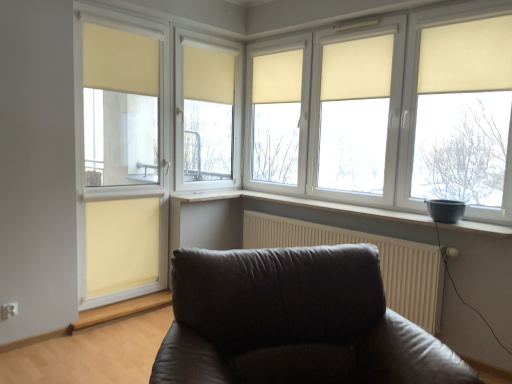
Find the location of a particular element. The image size is (512, 384). beige fabric curtain at center, acting as the 4th curtain starting from the right is located at coordinates pyautogui.click(x=208, y=74).

What do you see at coordinates (120, 60) in the screenshot?
I see `beige fabric curtain at upper left, arranged as the 5th curtain when viewed from the right` at bounding box center [120, 60].

Where is `translucent beige glass door at left`? This screenshot has height=384, width=512. translucent beige glass door at left is located at coordinates (121, 155).

The width and height of the screenshot is (512, 384). What do you see at coordinates (342, 208) in the screenshot?
I see `white matte window sill at center` at bounding box center [342, 208].

Consider the image. What is the approximate width of white matte window sill at center?

It is 27.93 centimeters.

This screenshot has width=512, height=384. Find the location of `beige fabric curtain at center, acting as the 4th curtain starting from the left`. beige fabric curtain at center, acting as the 4th curtain starting from the left is located at coordinates (277, 77).

At what (x,y) coordinates should I click in order to perform the action: click on beige fabric curtain at center, acting as the 4th curtain starting from the right. Please return your answer as a coordinate pair (x, y). Looking at the image, I should click on (208, 74).

Which object is thinner, beige fabric curtain at lower left, the 6th curtain when ordered from right to left, or translucent beige glass door at left?

beige fabric curtain at lower left, the 6th curtain when ordered from right to left, is thinner.

Does point (157, 237) appear closer or farther from the camera than point (112, 116)?

Clearly, point (157, 237) is more distant from the camera than point (112, 116).

Which of these two, beige fabric curtain at lower left, the 6th curtain when ordered from right to left, or translucent beige glass door at left, is bigger?

Bigger between the two is translucent beige glass door at left.

Is beige fabric curtain at lower left, arranged as the 1th curtain when viewed from the left, to the left or to the right of translucent beige glass door at left in the image?

From the image, it's evident that beige fabric curtain at lower left, arranged as the 1th curtain when viewed from the left, is to the left of translucent beige glass door at left.

Does beige fabric curtain at upper right, which is the sixth curtain from left to right, have a greater height compared to beige fabric curtain at center, acting as the third curtain starting from the right?

No, beige fabric curtain at upper right, which is the sixth curtain from left to right, is not taller than beige fabric curtain at center, acting as the third curtain starting from the right.

Image resolution: width=512 pixels, height=384 pixels. I want to click on curtain that is the 3rd one when counting downward from the beige fabric curtain at center, acting as the 4th curtain starting from the left (from the image's perspective), so click(x=466, y=56).

Is beige fabric curtain at upper right, which is the sixth curtain from left to right, oriented towards beige fabric curtain at center, acting as the third curtain starting from the right?

No.

Between beige fabric curtain at upper right, which is the sixth curtain from left to right, and beige fabric curtain at center, acting as the third curtain starting from the right, which one appears on the right side from the viewer's perspective?

beige fabric curtain at upper right, which is the sixth curtain from left to right, is more to the right.

Does beige fabric curtain at center, acting as the 4th curtain starting from the right, come behind beige fabric curtain at upper right, which is the sixth curtain from left to right?

Yes, beige fabric curtain at center, acting as the 4th curtain starting from the right, is further from the camera.

From a real-world perspective, relative to beige fabric curtain at upper right, which is counted as the first curtain, starting from the right, is beige fabric curtain at center, which is counted as the third curtain, starting from the left, vertically above or below?

Clearly, from a real-world perspective, beige fabric curtain at center, which is counted as the third curtain, starting from the left, is below beige fabric curtain at upper right, which is counted as the first curtain, starting from the right.

From the picture: Is beige fabric curtain at center, acting as the 4th curtain starting from the right, not close to beige fabric curtain at upper right, which is counted as the first curtain, starting from the right?

Absolutely, beige fabric curtain at center, acting as the 4th curtain starting from the right, is distant from beige fabric curtain at upper right, which is counted as the first curtain, starting from the right.

Is beige fabric curtain at center, acting as the 4th curtain starting from the right, bigger than beige fabric curtain at upper right, which is counted as the first curtain, starting from the right?

No.

From a real-world perspective, is white plastic window at upper right physically above white textured radiator at lower right?

Yes.

Between white plastic window at upper right and white textured radiator at lower right, which one has smaller size?

white textured radiator at lower right is smaller.

Does white plastic window at upper right turn towards white textured radiator at lower right?

No, white plastic window at upper right is not oriented towards white textured radiator at lower right.

Is white plastic window at upper right shorter than white textured radiator at lower right?

Incorrect, the height of white plastic window at upper right does not fall short of that of white textured radiator at lower right.

Consider the image. How different are the orientations of white matte window sill at center and beige fabric curtain at upper center, the 2th curtain in the right-to-left sequence, in degrees?

The angle between the facing direction of white matte window sill at center and the facing direction of beige fabric curtain at upper center, the 2th curtain in the right-to-left sequence, is 1.53 degrees.

Could you tell me if white matte window sill at center is turned towards beige fabric curtain at upper center, the 5th curtain positioned from the left?

No, white matte window sill at center is not aimed at beige fabric curtain at upper center, the 5th curtain positioned from the left.

Would you consider white matte window sill at center to be distant from beige fabric curtain at upper center, the 5th curtain positioned from the left?

white matte window sill at center is positioned a significant distance from beige fabric curtain at upper center, the 5th curtain positioned from the left.

Does point (504, 229) come in front of point (373, 73)?

That is True.

Is beige fabric curtain at center, acting as the third curtain starting from the right, turned away from beige fabric curtain at upper right, which is the sixth curtain from left to right?

No, beige fabric curtain at center, acting as the third curtain starting from the right, is not facing away from beige fabric curtain at upper right, which is the sixth curtain from left to right.

Is beige fabric curtain at center, acting as the third curtain starting from the right, positioned beyond the bounds of beige fabric curtain at upper right, which is counted as the first curtain, starting from the right?

Yes, beige fabric curtain at center, acting as the third curtain starting from the right, is outside of beige fabric curtain at upper right, which is counted as the first curtain, starting from the right.

Is beige fabric curtain at center, acting as the 4th curtain starting from the left, wider than beige fabric curtain at upper right, which is the sixth curtain from left to right?

No.

Is beige fabric curtain at center, acting as the third curtain starting from the right, positioned behind beige fabric curtain at upper right, which is counted as the first curtain, starting from the right?

Yes, it is.

In the scene shown: From their relative heights in the image, would you say beige fabric curtain at upper center, the 2th curtain in the right-to-left sequence, is taller or shorter than beige fabric curtain at center, acting as the 4th curtain starting from the right?

beige fabric curtain at upper center, the 2th curtain in the right-to-left sequence, is shorter than beige fabric curtain at center, acting as the 4th curtain starting from the right.

Which object is closer to the camera, beige fabric curtain at upper center, the 5th curtain positioned from the left, or beige fabric curtain at center, which is counted as the third curtain, starting from the left?

beige fabric curtain at upper center, the 5th curtain positioned from the left, is in front.

Can you see beige fabric curtain at upper center, the 5th curtain positioned from the left, touching beige fabric curtain at center, acting as the 4th curtain starting from the right?

No, beige fabric curtain at upper center, the 5th curtain positioned from the left, is not with beige fabric curtain at center, acting as the 4th curtain starting from the right.

Which is in front, point (385, 73) or point (221, 84)?

The point (385, 73) is in front.

The width and height of the screenshot is (512, 384). Identify the location of curtain below the translucent beige glass door at left (from a real-world perspective). pyautogui.click(x=121, y=245).

I want to click on the 3rd curtain above the beige fabric curtain at upper right, which is the sixth curtain from left to right (from the image's perspective), so click(277, 77).

From the image, which object appears to be farther from white plastic window at upper right, translucent beige glass door at left or white matte window sill at center?

translucent beige glass door at left lies further to white plastic window at upper right than the other object.

From the image, which object appears to be farther from translucent beige glass door at left, white plastic window at upper right or beige fabric curtain at center, acting as the 4th curtain starting from the right?

white plastic window at upper right is further to translucent beige glass door at left.

Looking at the image, which one is located closer to beige fabric curtain at center, acting as the 4th curtain starting from the right, beige fabric curtain at upper left, arranged as the second curtain when viewed from the left, or beige fabric curtain at upper right, which is the sixth curtain from left to right?

beige fabric curtain at upper left, arranged as the second curtain when viewed from the left.

Which object lies nearer to the anchor point beige fabric curtain at upper right, which is counted as the first curtain, starting from the right, beige fabric curtain at upper center, the 5th curtain positioned from the left, or beige fabric curtain at center, acting as the 4th curtain starting from the left?

beige fabric curtain at upper center, the 5th curtain positioned from the left, is closer to beige fabric curtain at upper right, which is counted as the first curtain, starting from the right.

When comparing their distances from beige fabric curtain at upper right, which is counted as the first curtain, starting from the right, does beige fabric curtain at upper center, the 2th curtain in the right-to-left sequence, or beige fabric curtain at center, acting as the 4th curtain starting from the right, seem further?

beige fabric curtain at center, acting as the 4th curtain starting from the right, is positioned further to the anchor beige fabric curtain at upper right, which is counted as the first curtain, starting from the right.

Which object lies further to the anchor point beige fabric curtain at upper left, arranged as the second curtain when viewed from the left, beige fabric curtain at upper right, which is the sixth curtain from left to right, or beige fabric curtain at center, acting as the 4th curtain starting from the right?

beige fabric curtain at upper right, which is the sixth curtain from left to right.

When comparing their distances from beige fabric curtain at center, which is counted as the third curtain, starting from the left, does white textured radiator at lower right or beige fabric curtain at upper center, the 5th curtain positioned from the left, seem closer?

beige fabric curtain at upper center, the 5th curtain positioned from the left, is positioned closer to the anchor beige fabric curtain at center, which is counted as the third curtain, starting from the left.

When comparing their distances from white matte window sill at center, does beige fabric curtain at center, acting as the third curtain starting from the right, or translucent beige glass door at left seem further?

translucent beige glass door at left is further to white matte window sill at center.

This screenshot has height=384, width=512. I want to click on window sill between beige fabric curtain at lower left, arranged as the 1th curtain when viewed from the left, and beige fabric curtain at upper right, which is the sixth curtain from left to right, so click(342, 208).

Where is `window sill between beige fabric curtain at lower left, arranged as the 1th curtain when viewed from the left, and beige fabric curtain at upper center, the 2th curtain in the right-to-left sequence, in the horizontal direction`? This screenshot has height=384, width=512. window sill between beige fabric curtain at lower left, arranged as the 1th curtain when viewed from the left, and beige fabric curtain at upper center, the 2th curtain in the right-to-left sequence, in the horizontal direction is located at coordinates pyautogui.click(x=342, y=208).

The width and height of the screenshot is (512, 384). What are the coordinates of `window between beige fabric curtain at upper center, the 2th curtain in the right-to-left sequence, and white textured radiator at lower right from top to bottom` in the screenshot? It's located at (320, 70).

The image size is (512, 384). Identify the location of radiator between translucent beige glass door at left and white plastic window at upper right from left to right. (379, 256).